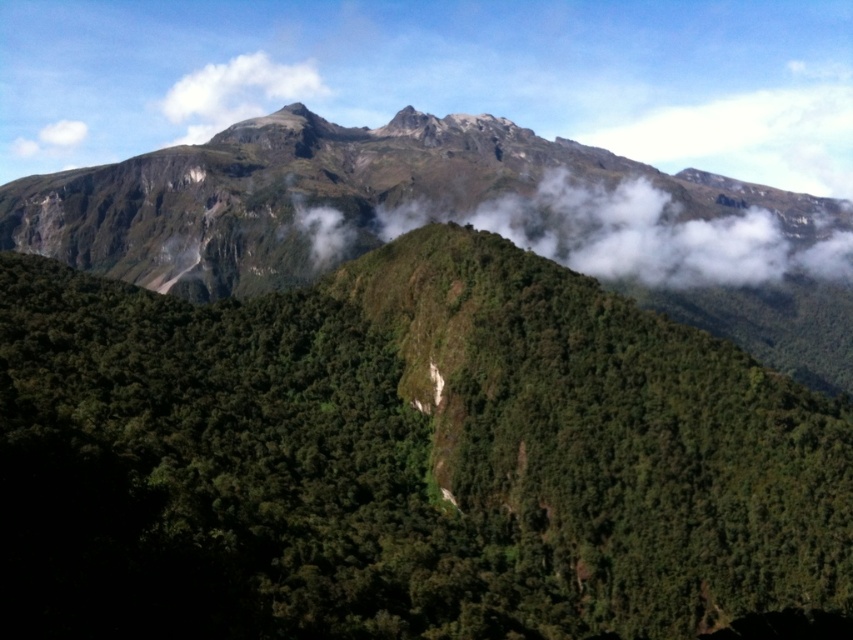
Is rugged rock mountain at upper center above white fluffy cloud at upper center?

No, rugged rock mountain at upper center is not above white fluffy cloud at upper center.

Which is above, rugged rock mountain at upper center or white fluffy cloud at upper center?

white fluffy cloud at upper center is above.

Between point (393, 196) and point (315, 74), which one is positioned in front?

Point (393, 196) is in front.

Image resolution: width=853 pixels, height=640 pixels. I want to click on rugged rock mountain at upper center, so click(x=323, y=195).

Can you confirm if green leafy hillside at center is smaller than rugged rock mountain at upper center?

Correct, green leafy hillside at center occupies less space than rugged rock mountain at upper center.

Describe the element at coordinates (405, 460) in the screenshot. I see `green leafy hillside at center` at that location.

Find the location of a particular element. This screenshot has height=640, width=853. green leafy hillside at center is located at coordinates (405, 460).

Can you confirm if green leafy hillside at center is positioned below white fluffy cloud at upper center?

Yes.

At what (x,y) coordinates should I click in order to perform the action: click on green leafy hillside at center. Please return your answer as a coordinate pair (x, y). The image size is (853, 640). Looking at the image, I should click on (405, 460).

Which is behind, point (816, 556) or point (241, 116)?

Positioned behind is point (241, 116).

Locate an element on the screen. Image resolution: width=853 pixels, height=640 pixels. green leafy hillside at center is located at coordinates (405, 460).